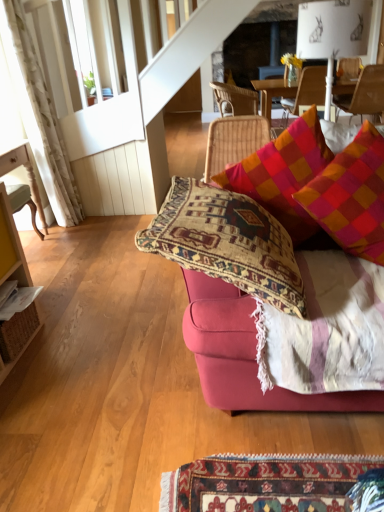
Find the location of `multicolored woven cushion at upper right, which is the first pillow from left to right`. multicolored woven cushion at upper right, which is the first pillow from left to right is located at coordinates (285, 177).

In order to face white textured curtain at left, should I rotate leftwards or rightwards?

A 18.958 degree turn to the left will do.

Measure the distance between velvet pink couch at center and camera.

The distance of velvet pink couch at center from camera is 4.38 feet.

Image resolution: width=384 pixels, height=512 pixels. What do you see at coordinates (244, 355) in the screenshot?
I see `velvet pink couch at center` at bounding box center [244, 355].

Find the location of a particular element. This screenshot has height=512, width=384. wooden chair at upper right, the third chair when ordered from back to front is located at coordinates (365, 93).

The height and width of the screenshot is (512, 384). Identify the location of wooden chair at upper right, arranged as the 3th chair when viewed from the left. (307, 90).

I want to click on multicolored woven cushion at upper right, acting as the 2th pillow starting from the right, so click(285, 177).

Would you say wooden chair at upper right, which is the first chair from right to left, is outside multicolored woven cushion at upper right, which is the first pillow from left to right?

Indeed, wooden chair at upper right, which is the first chair from right to left, is completely outside multicolored woven cushion at upper right, which is the first pillow from left to right.

Does wooden chair at upper right, which is the fourth chair in left-to-right order, have a lesser height compared to multicolored woven cushion at upper right, acting as the 2th pillow starting from the right?

Yes.

Is wooden chair at upper right, the third chair when ordered from back to front, bigger or smaller than multicolored woven cushion at upper right, acting as the 2th pillow starting from the right?

In the image, wooden chair at upper right, the third chair when ordered from back to front, appears to be larger than multicolored woven cushion at upper right, acting as the 2th pillow starting from the right.

Based on the photo, is wooden chair at upper right, acting as the second chair starting from the front, looking in the opposite direction of multicolored woven cushion at upper right, which is the first pillow from left to right?

No, wooden chair at upper right, acting as the second chair starting from the front, is not facing away from multicolored woven cushion at upper right, which is the first pillow from left to right.

Would you say multicolored woven cushion at upper right, which is the first pillow from left to right, is inside or outside wooden chair at upper right, the third chair when ordered from back to front?

multicolored woven cushion at upper right, which is the first pillow from left to right, cannot be found inside wooden chair at upper right, the third chair when ordered from back to front.

Does multicolored woven cushion at upper right, which is the first pillow from left to right, have a greater height compared to wooden chair at upper right, the third chair when ordered from back to front?

Correct, multicolored woven cushion at upper right, which is the first pillow from left to right, is much taller as wooden chair at upper right, the third chair when ordered from back to front.

Is multicolored woven cushion at upper right, which is the first pillow from left to right, positioned far away from wooden chair at upper right, which is the first chair from right to left?

Actually, multicolored woven cushion at upper right, which is the first pillow from left to right, and wooden chair at upper right, which is the first chair from right to left, are a little close together.

Locate an element on the screen. This screenshot has height=512, width=384. the 2nd pillow directly above the wooden chair at upper right, which is the fourth chair in left-to-right order (from a real-world perspective) is located at coordinates (285, 177).

Relative to wooden chair at left, which ranks as the fourth chair in back-to-front order, is rattan chair at upper center, marked as the fourth chair in a front-to-back arrangement, in front or behind?

Clearly, rattan chair at upper center, marked as the fourth chair in a front-to-back arrangement, is behind wooden chair at left, which ranks as the fourth chair in back-to-front order.

Image resolution: width=384 pixels, height=512 pixels. Find the location of `chair that is the 3rd object located above the wooden chair at left, which appears as the 1th chair when viewed from the left (from the image's perspective)`. chair that is the 3rd object located above the wooden chair at left, which appears as the 1th chair when viewed from the left (from the image's perspective) is located at coordinates (235, 99).

Is rattan chair at upper center, positioned as the 1th chair in back-to-front order, positioned beyond the bounds of wooden chair at left, the 4th chair viewed from the right?

That's correct, rattan chair at upper center, positioned as the 1th chair in back-to-front order, is outside of wooden chair at left, the 4th chair viewed from the right.

Is wooden chair at left, which appears as the 1th chair when viewed from the left, at the back of rattan chair at upper center, the 3th chair viewed from the right?

rattan chair at upper center, the 3th chair viewed from the right, is not turned away from wooden chair at left, which appears as the 1th chair when viewed from the left.

Is velvet pink couch at center facing towards multicolored woven cushion at upper right, which is the first pillow from left to right?

No.

Is velvet pink couch at center touching multicolored woven cushion at upper right, acting as the 2th pillow starting from the right?

No, velvet pink couch at center is not making contact with multicolored woven cushion at upper right, acting as the 2th pillow starting from the right.

Considering the sizes of velvet pink couch at center and multicolored woven cushion at upper right, acting as the 2th pillow starting from the right, in the image, is velvet pink couch at center bigger or smaller than multicolored woven cushion at upper right, acting as the 2th pillow starting from the right,?

velvet pink couch at center is bigger than multicolored woven cushion at upper right, acting as the 2th pillow starting from the right.

Considering the points (225, 317) and (272, 151), which point is in front, point (225, 317) or point (272, 151)?

Point (225, 317)

Based on the photo, is the position of plaid fabric pillow at upper right, positioned as the 1th pillow in right-to-left order, more distant than that of wooden chair at upper right, acting as the second chair starting from the front?

No, it is not.

From the image's perspective, which pillow is the 2nd one below the wooden chair at upper right, which is the first chair from right to left? Please provide its 2D coordinates.

[(351, 196)]

From a real-world perspective, is plaid fabric pillow at upper right, positioned as the 1th pillow in right-to-left order, under wooden chair at upper right, which is the fourth chair in left-to-right order?

Incorrect, from a real-world perspective, plaid fabric pillow at upper right, positioned as the 1th pillow in right-to-left order, is higher than wooden chair at upper right, which is the fourth chair in left-to-right order.

Is plaid fabric pillow at upper right, the 2th pillow positioned from the left, positioned with its back to wooden chair at upper right, which is the first chair from right to left?

No.

Does velvet pink couch at center have a smaller size compared to wooden chair at left, the 4th chair viewed from the right?

No, velvet pink couch at center is not smaller than wooden chair at left, the 4th chair viewed from the right.

Is wooden chair at left, which ranks as the fourth chair in back-to-front order, inside velvet pink couch at center?

Definitely not — wooden chair at left, which ranks as the fourth chair in back-to-front order, is not inside velvet pink couch at center.

Which is closer to the camera, (230,383) or (14,184)?

The point (230,383) is in front.

Can you confirm if velvet pink couch at center is positioned to the right of wooden chair at left, the 4th chair viewed from the right?

Correct, you'll find velvet pink couch at center to the right of wooden chair at left, the 4th chair viewed from the right.

Are white textured curtain at left and wooden chair at upper right, marked as the 2th chair in a right-to-left arrangement, far apart?

Indeed, white textured curtain at left is not near wooden chair at upper right, marked as the 2th chair in a right-to-left arrangement.

Which of these two, white textured curtain at left or wooden chair at upper right, arranged as the 3th chair when viewed from the left, is thinner?

With smaller width is white textured curtain at left.

From a real-world perspective, is white textured curtain at left located higher than wooden chair at upper right, which is counted as the third chair, starting from the front?

Indeed, from a real-world perspective, white textured curtain at left stands above wooden chair at upper right, which is counted as the third chair, starting from the front.

Identify the location of curtain below the wooden chair at upper right, arranged as the 3th chair when viewed from the left (from the image's perspective). This screenshot has height=512, width=384. (40, 117).

Where is `the 2nd pillow to the left of the wooden chair at upper right, which is the fourth chair in left-to-right order, starting your count from the anchor`? This screenshot has width=384, height=512. the 2nd pillow to the left of the wooden chair at upper right, which is the fourth chair in left-to-right order, starting your count from the anchor is located at coordinates (285, 177).

From the image's perspective, count 1st chairs upward from the multicolored woven cushion at upper right, acting as the 2th pillow starting from the right, and point to it. Please provide its 2D coordinates.

[(365, 93)]

Consider the image. From the image, which object appears to be farther from plaid fabric pillow at upper right, positioned as the 1th pillow in right-to-left order, rattan chair at upper center, positioned as the 1th chair in back-to-front order, or wooden chair at upper right, positioned as the second chair in back-to-front order?

rattan chair at upper center, positioned as the 1th chair in back-to-front order, is further to plaid fabric pillow at upper right, positioned as the 1th pillow in right-to-left order.

Consider the image. Estimate the real-world distances between objects in this image. Which object is closer to wooden chair at upper right, acting as the second chair starting from the front, velvet pink couch at center or multicolored woven cushion at upper right, which is the first pillow from left to right?

multicolored woven cushion at upper right, which is the first pillow from left to right.

Estimate the real-world distances between objects in this image. Which object is further from wooden chair at upper right, which is the first chair from right to left, plaid fabric pillow at upper right, positioned as the 1th pillow in right-to-left order, or wooden chair at left, the 4th chair viewed from the right?

wooden chair at left, the 4th chair viewed from the right.

From the image, which object appears to be nearer to wooden chair at upper right, marked as the 2th chair in a right-to-left arrangement, wooden chair at left, the first chair in the front-to-back sequence, or rattan chair at upper center, marked as the fourth chair in a front-to-back arrangement?

rattan chair at upper center, marked as the fourth chair in a front-to-back arrangement, is closer to wooden chair at upper right, marked as the 2th chair in a right-to-left arrangement.

Looking at the image, which one is located further to white textured curtain at left, velvet pink couch at center or wooden chair at upper right, acting as the second chair starting from the front?

velvet pink couch at center is further to white textured curtain at left.

Estimate the real-world distances between objects in this image. Which object is further from plaid fabric pillow at upper right, the 2th pillow positioned from the left, multicolored woven cushion at upper right, which is the first pillow from left to right, or wooden chair at upper right, positioned as the second chair in back-to-front order?

Among the two, wooden chair at upper right, positioned as the second chair in back-to-front order, is located further to plaid fabric pillow at upper right, the 2th pillow positioned from the left.

Looking at the image, which one is located further to rattan chair at upper center, the 3th chair viewed from the right, wooden chair at upper right, which is the fourth chair in left-to-right order, or multicolored woven cushion at upper right, acting as the 2th pillow starting from the right?

multicolored woven cushion at upper right, acting as the 2th pillow starting from the right, lies further to rattan chair at upper center, the 3th chair viewed from the right, than the other object.

When comparing their distances from multicolored woven cushion at upper right, acting as the 2th pillow starting from the right, does wooden chair at left, which ranks as the fourth chair in back-to-front order, or velvet pink couch at center seem closer?

Based on the image, velvet pink couch at center appears to be nearer to multicolored woven cushion at upper right, acting as the 2th pillow starting from the right.

Image resolution: width=384 pixels, height=512 pixels. What are the coordinates of `curtain between velvet pink couch at center and wooden chair at upper right, arranged as the 3th chair when viewed from the left, from front to back` in the screenshot? It's located at (40, 117).

Locate an element on the screen. Image resolution: width=384 pixels, height=512 pixels. studio couch located between wooden chair at left, which ranks as the fourth chair in back-to-front order, and plaid fabric pillow at upper right, the 2th pillow positioned from the left, in the left-right direction is located at coordinates (244, 355).

Identify the location of curtain between wooden chair at left, which ranks as the fourth chair in back-to-front order, and wooden chair at upper right, acting as the second chair starting from the front, in the horizontal direction. The width and height of the screenshot is (384, 512). (40, 117).

Locate an element on the screen. The height and width of the screenshot is (512, 384). curtain situated between wooden chair at left, the first chair in the front-to-back sequence, and plaid fabric pillow at upper right, positioned as the 1th pillow in right-to-left order, from left to right is located at coordinates (40, 117).